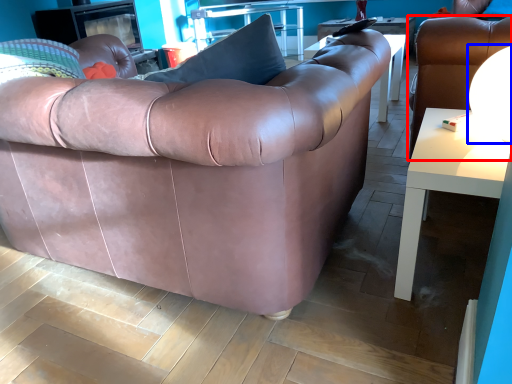
Question: Which object appears closest to the camera in this image, chair (highlighted by a red box) or lamp (highlighted by a blue box)?

Choices:
 (A) chair
 (B) lamp

Answer: (B)